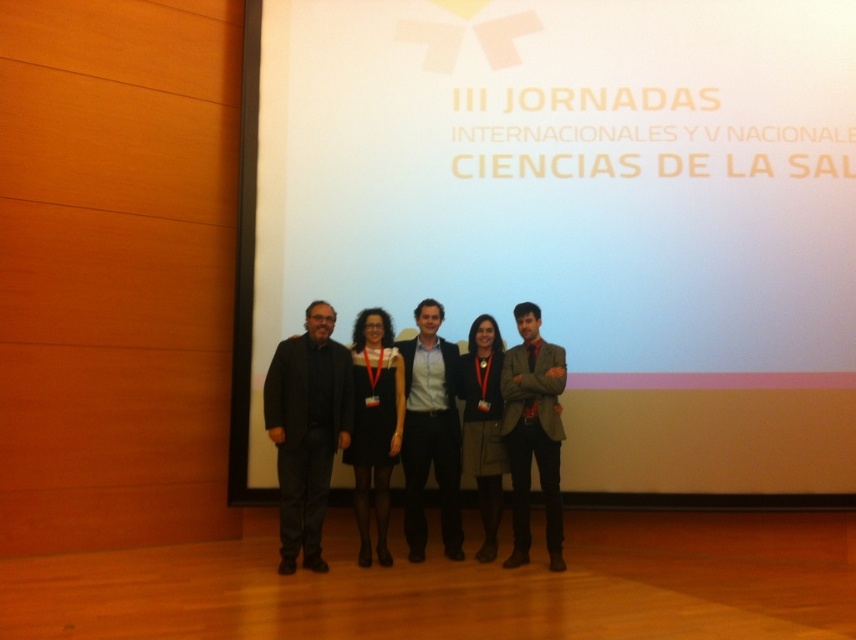
Is black matte dress at center positioned at the back of dark gray wool coat at center?

No, black matte dress at center is closer to the viewer.

Is point (370, 339) behind point (490, 376)?

No, (370, 339) is closer to viewer.

Identify the location of black matte dress at center. click(373, 426).

Can you confirm if black matte suit at left is shorter than dark gray wool coat at center?

In fact, black matte suit at left may be taller than dark gray wool coat at center.

Is black matte suit at left closer to the viewer compared to dark gray wool coat at center?

Yes, black matte suit at left is in front of dark gray wool coat at center.

Is point (294, 362) positioned behind point (484, 317)?

No, (294, 362) is closer to viewer.

Where is `black matte suit at left`? black matte suit at left is located at coordinates (307, 429).

Image resolution: width=856 pixels, height=640 pixels. What do you see at coordinates (431, 432) in the screenshot?
I see `light blue shirt at center` at bounding box center [431, 432].

Does light blue shirt at center come in front of black matte dress at center?

That is False.

I want to click on light blue shirt at center, so click(x=431, y=432).